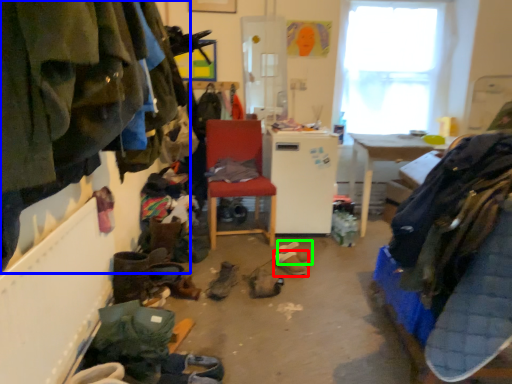
Question: Estimate the real-world distances between objects in this image. Which object is farther from footwear (highlighted by a red box), clothing (highlighted by a blue box) or footwear (highlighted by a green box)?

Choices:
 (A) clothing
 (B) footwear

Answer: (A)